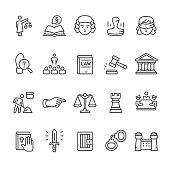
Where is `table`? table is located at coordinates (147, 105).